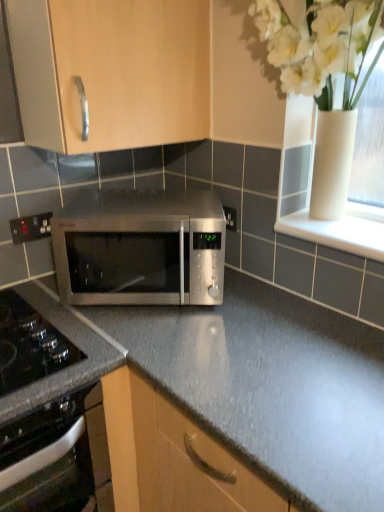
Question: Can you confirm if white glossy window sill at upper right is wider than black glass oven at lower left?

Choices:
 (A) yes
 (B) no

Answer: (B)

Question: Is white glossy window sill at upper right to the right of black glass oven at lower left from the viewer's perspective?

Choices:
 (A) yes
 (B) no

Answer: (A)

Question: Are white glossy window sill at upper right and black glass oven at lower left far apart?

Choices:
 (A) yes
 (B) no

Answer: (B)

Question: Does white glossy window sill at upper right turn towards black glass oven at lower left?

Choices:
 (A) no
 (B) yes

Answer: (A)

Question: From a real-world perspective, is white glossy window sill at upper right on top of black glass oven at lower left?

Choices:
 (A) yes
 (B) no

Answer: (A)

Question: Do you think white glossy vase at upper right is within white glossy window sill at upper right, or outside of it?

Choices:
 (A) outside
 (B) inside

Answer: (A)

Question: Is point (289, 46) closer or farther from the camera than point (304, 232)?

Choices:
 (A) farther
 (B) closer

Answer: (B)

Question: From a real-world perspective, relative to white glossy window sill at upper right, is white glossy vase at upper right vertically above or below?

Choices:
 (A) below
 (B) above

Answer: (B)

Question: Is white glossy vase at upper right bigger or smaller than white glossy window sill at upper right?

Choices:
 (A) small
 (B) big

Answer: (B)

Question: From the image's perspective, is stainless steel microwave at center positioned above or below black plastic electrical outlet at lower left?

Choices:
 (A) above
 (B) below

Answer: (B)

Question: Is stainless steel microwave at center to the left or to the right of black plastic electrical outlet at lower left in the image?

Choices:
 (A) right
 (B) left

Answer: (A)

Question: Considering the positions of stainless steel microwave at center and black plastic electrical outlet at lower left in the image, is stainless steel microwave at center taller or shorter than black plastic electrical outlet at lower left?

Choices:
 (A) tall
 (B) short

Answer: (A)

Question: In terms of size, does stainless steel microwave at center appear bigger or smaller than black plastic electrical outlet at lower left?

Choices:
 (A) small
 (B) big

Answer: (B)

Question: Would you say black plastic electrical outlet at lower left is to the left or to the right of white glossy window sill at upper right in the picture?

Choices:
 (A) left
 (B) right

Answer: (A)

Question: From a real-world perspective, is black plastic electrical outlet at lower left positioned above or below white glossy window sill at upper right?

Choices:
 (A) above
 (B) below

Answer: (B)